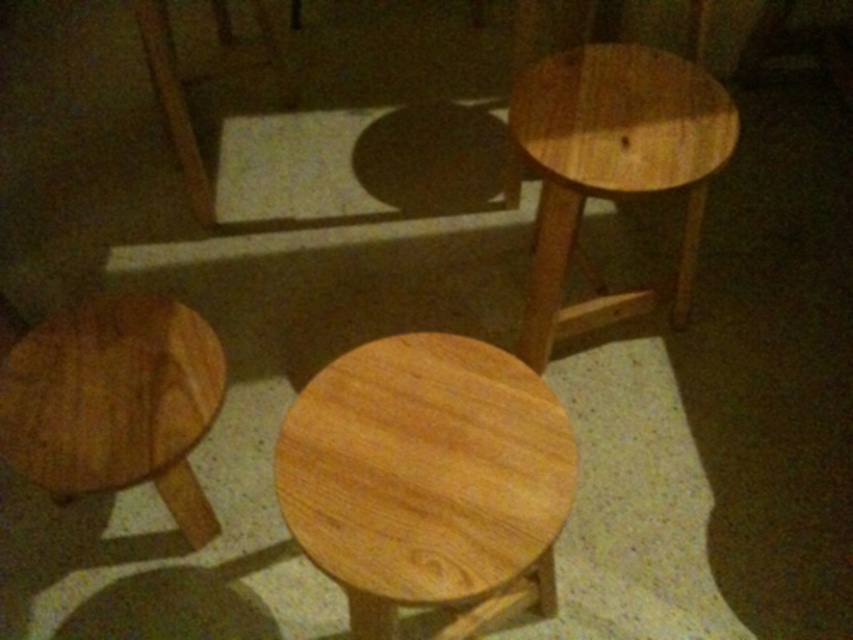
Question: Does natural wood table at center have a greater width compared to natural wood stool at lower left?

Choices:
 (A) no
 (B) yes

Answer: (B)

Question: Which point is farther to the camera?

Choices:
 (A) natural wood stool at lower left
 (B) natural wood stool at upper right
 (C) natural wood table at center

Answer: (B)

Question: Estimate the real-world distances between objects in this image. Which object is farther from the natural wood stool at upper right?

Choices:
 (A) natural wood stool at lower left
 (B) natural wood table at center

Answer: (A)

Question: Which object appears closest to the camera in this image?

Choices:
 (A) natural wood table at center
 (B) natural wood stool at upper right

Answer: (A)

Question: Considering the relative positions of natural wood table at center and natural wood stool at upper right in the image provided, where is natural wood table at center located with respect to natural wood stool at upper right?

Choices:
 (A) right
 (B) left

Answer: (B)

Question: Can you confirm if natural wood table at center is smaller than natural wood stool at upper right?

Choices:
 (A) yes
 (B) no

Answer: (A)